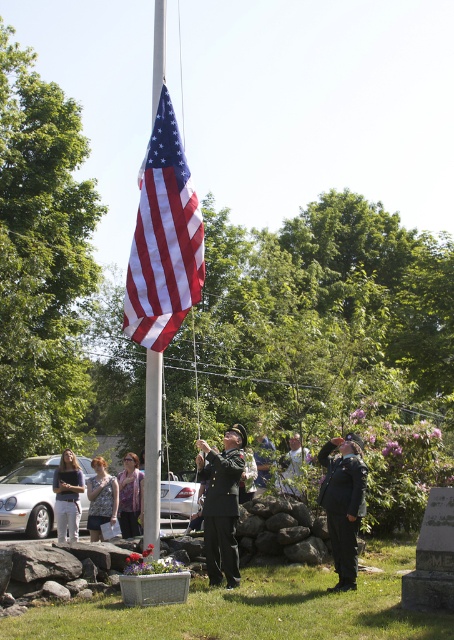
You are a photographer at the ceremony and want to capture a photo of the light brown hair at lower left and white cotton shirt at center. Which object should be placed in the foreground to ensure both are visible?

The light brown hair at lower left is taller than the white cotton shirt at center, so placing the light brown hair at lower left in the foreground would ensure both are visible.

Based on the scene description, can you determine the spatial relationship between the uniformed officer at center and the light brown hair at lower left?

The uniformed officer at center is positioned to the right of the light brown hair at lower left.

In the scene shown: You are attending a flag ceremony and notice two people in the scene. One has light brown hair at lower left and the other is wearing a white cotton shirt at center. Which person is positioned closer to the ground?

The light brown hair at lower left is located below the white cotton shirt at center, so the person with light brown hair at lower left is closer to the ground.